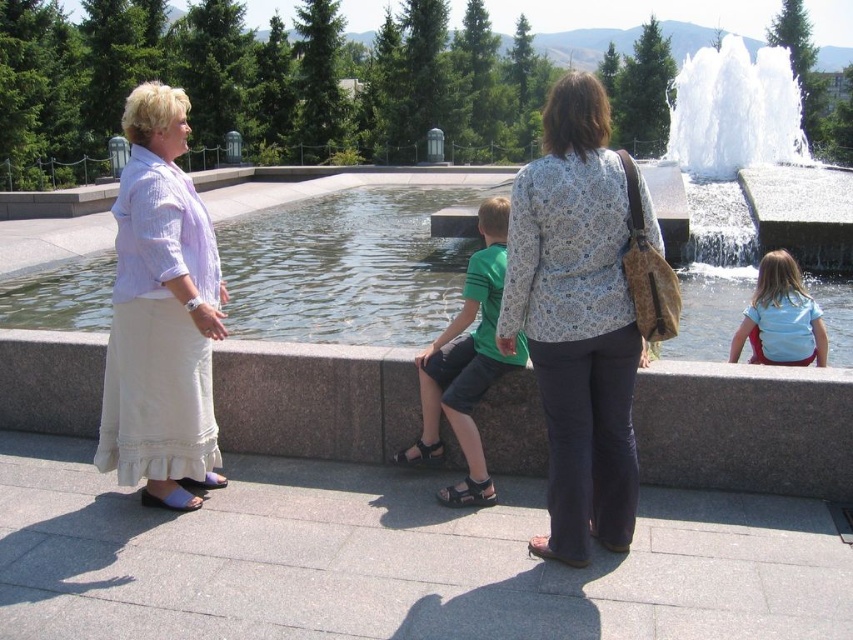
Question: Which point is farther from the camera taking this photo?

Choices:
 (A) (451, 365)
 (B) (438, 326)
 (C) (733, 97)

Answer: (C)

Question: Which point is farther to the camera?

Choices:
 (A) light blue fabric at lower right
 (B) white frothy water at upper center

Answer: (B)

Question: Where is gray concrete ledge at center located in relation to clear water at fountain center in the image?

Choices:
 (A) left
 (B) right

Answer: (B)

Question: Which of the following is the farthest from the observer?

Choices:
 (A) (795, 268)
 (B) (590, 243)
 (C) (115, 385)

Answer: (A)

Question: Is gray concrete ledge at center above white frothy water at upper center?

Choices:
 (A) no
 (B) yes

Answer: (A)

Question: From the image, what is the correct spatial relationship of white frothy water at upper center in relation to green fabric shirt at center?

Choices:
 (A) above
 (B) below

Answer: (A)